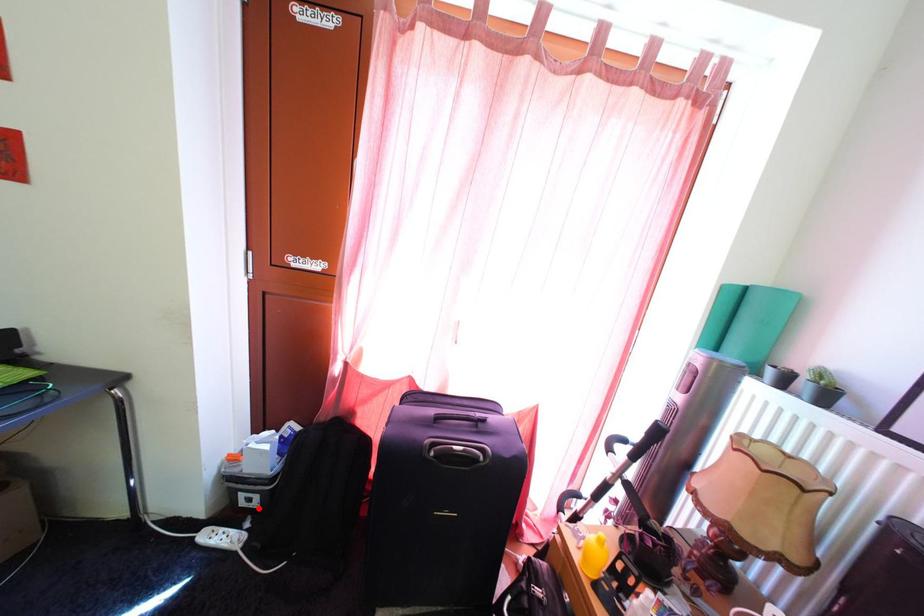
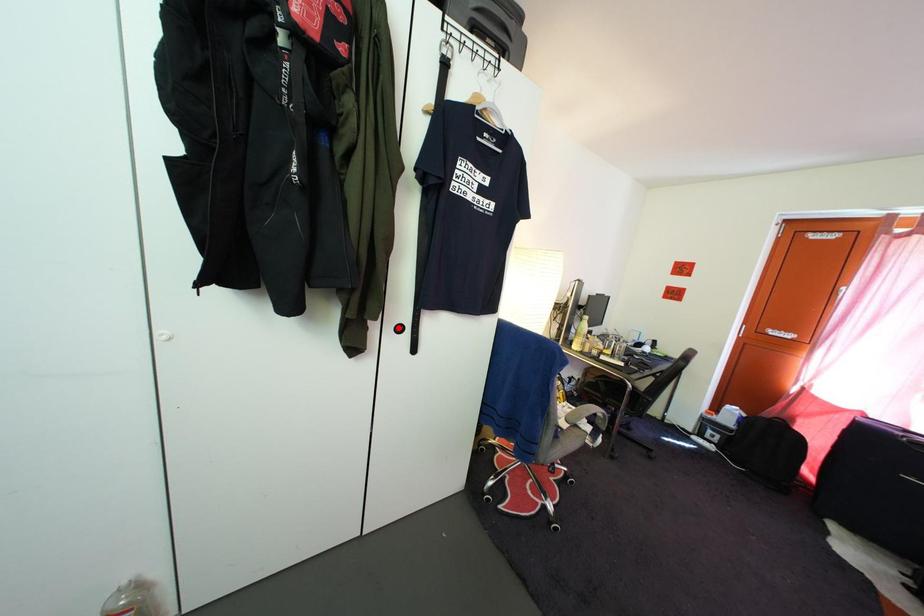
I am providing you with two images of the same scene from different viewpoints. A red point is marked on the first image and another point is marked on the second image. Is the red point in image1 aligned with the point shown in image2?

No